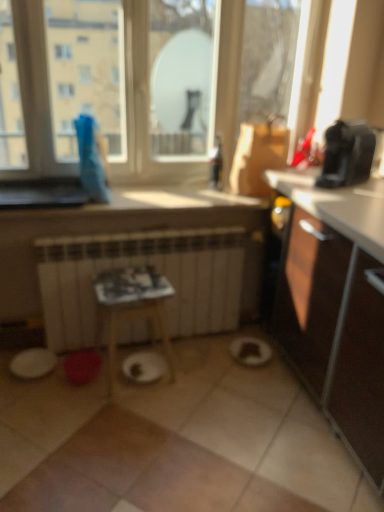
You are a GUI agent. You are given a task and a screenshot of the screen. Output one action in this format:
    pyautogui.click(x=<x>, y=<y>)
    Task: Click on the blank space situated above wooden table at center (from a real-world perspective)
    Image resolution: width=384 pixels, height=512 pixels.
    Given the screenshot: What is the action you would take?
    pyautogui.click(x=132, y=280)